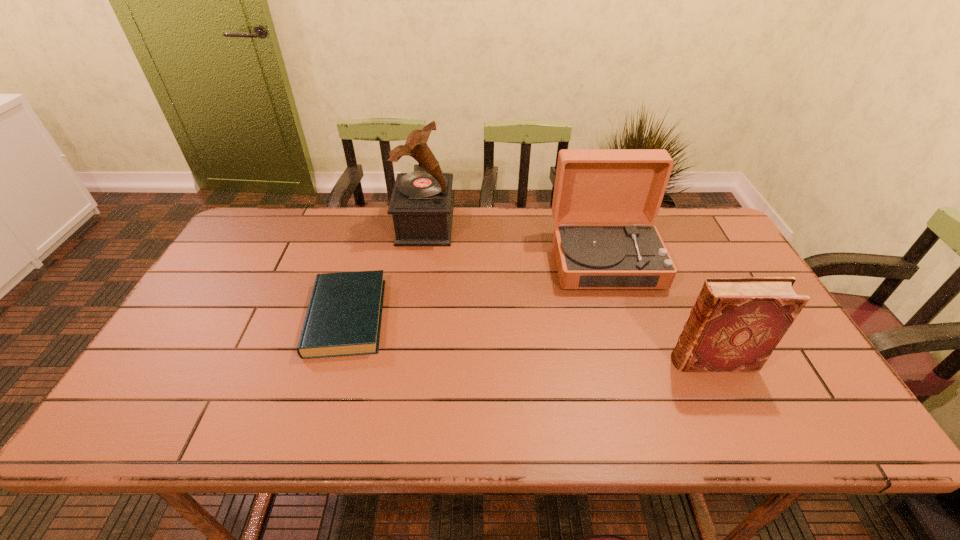
At what (x,y) coordinates should I click in order to perform the action: click on blank area located on the spine side of the second shortest object. Please return your answer as a coordinate pair (x, y). This screenshot has width=960, height=540. Looking at the image, I should click on (610, 361).

This screenshot has width=960, height=540. Find the location of `free region located on the spine side of the second shortest object`. free region located on the spine side of the second shortest object is located at coordinates (548, 361).

What are the coordinates of `vacant area situated on the right of the left book` in the screenshot? It's located at (491, 317).

The width and height of the screenshot is (960, 540). What are the coordinates of `object present at the right edge` in the screenshot? It's located at (736, 323).

Identify the location of vacant space at the far edge of the desktop. Image resolution: width=960 pixels, height=540 pixels. (340, 238).

Image resolution: width=960 pixels, height=540 pixels. I want to click on free space at the near edge of the desktop, so click(413, 416).

The width and height of the screenshot is (960, 540). What are the coordinates of `vacant space at the left edge of the desktop` in the screenshot? It's located at (216, 273).

This screenshot has height=540, width=960. I want to click on free space at the right edge, so click(734, 254).

In order to click on vacant space at the near left corner of the desktop in this screenshot , I will do `click(143, 408)`.

Image resolution: width=960 pixels, height=540 pixels. Find the location of `free spot between the right phonograph record and the shorter book`. free spot between the right phonograph record and the shorter book is located at coordinates (476, 288).